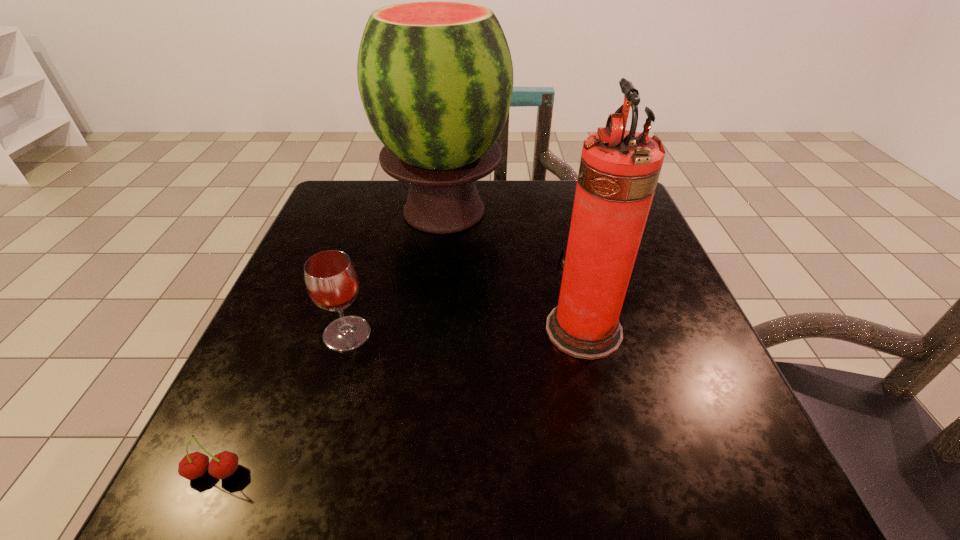
This screenshot has height=540, width=960. What are the coordinates of `free space at the left edge of the desktop` in the screenshot? It's located at (281, 296).

In the image, there is a desktop. At what (x,y) coordinates should I click in order to perform the action: click on free space at the right edge. Please return your answer as a coordinate pair (x, y). The image size is (960, 540). Looking at the image, I should click on (659, 299).

Identify the location of free space at the far left corner of the desktop. (343, 208).

You are a GUI agent. You are given a task and a screenshot of the screen. Output one action in this format:
    pyautogui.click(x=<x>, y=<y>)
    Task: Click on the free spot between the rightmost object and the third tallest object
    
    Given the screenshot: What is the action you would take?
    pyautogui.click(x=466, y=332)

I want to click on vacant area that lies between the farthest object and the rightmost object, so click(x=514, y=270).

I want to click on free space between the fire extinguisher and the cherry, so click(x=399, y=401).

In order to click on unoccupied position between the shortest object and the second shortest object in this screenshot , I will do `click(280, 403)`.

Image resolution: width=960 pixels, height=540 pixels. What are the coordinates of `empty location between the rightmost object and the farthest object` in the screenshot? It's located at (514, 270).

This screenshot has width=960, height=540. I want to click on vacant area between the farthest object and the second shortest object, so click(x=396, y=272).

Identify the location of free space between the nearest object and the wineglass. The image size is (960, 540). (280, 403).